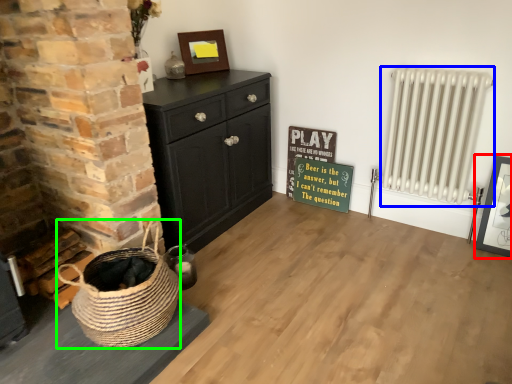
Question: Considering the real-world distances, which object is farthest from picture frame (highlighted by a red box)? radiator (highlighted by a blue box) or basket (highlighted by a green box)?

Choices:
 (A) radiator
 (B) basket

Answer: (B)